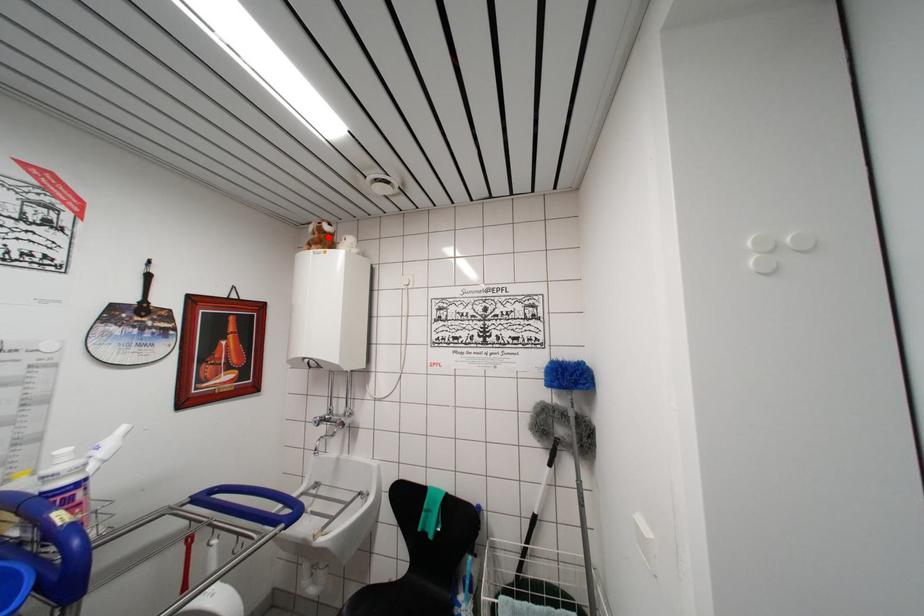
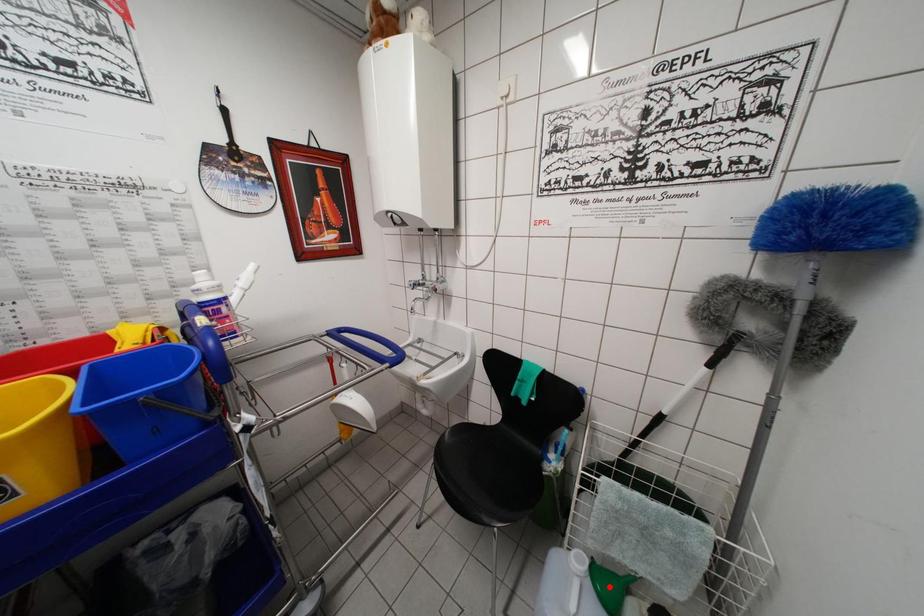
I am providing you with two images of the same scene from different viewpoints. A red point is marked on the first image and another point is marked on the second image. Is the red point in image1 aligned with the point shown in image2?

No